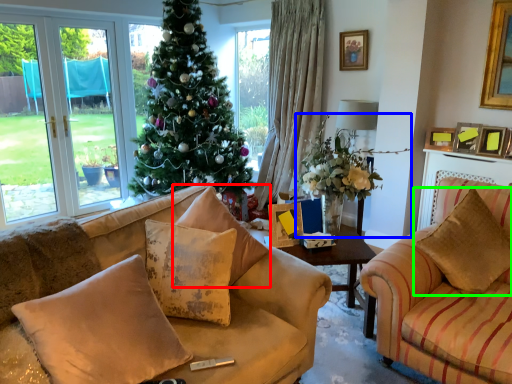
Question: Which object is positioned closest to pillow (highlighted by a red box)? Select from houseplant (highlighted by a blue box) and pillow (highlighted by a green box).

Choices:
 (A) houseplant
 (B) pillow

Answer: (A)